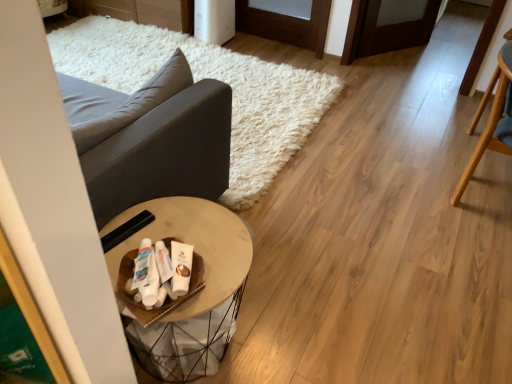
In order to click on vacant area that is situated to the right of white glossy tube at center, the 2th toiletry from the left in this screenshot , I will do `click(215, 274)`.